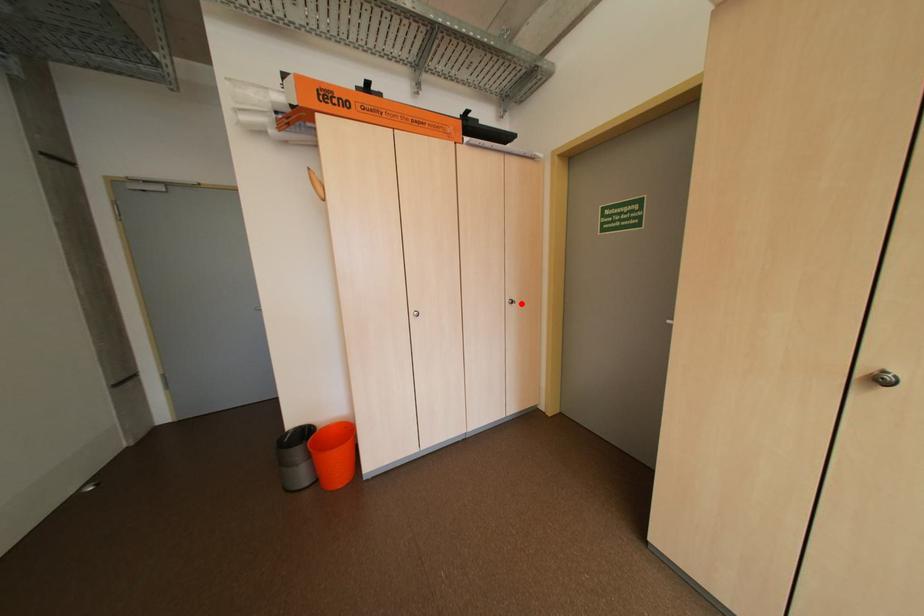
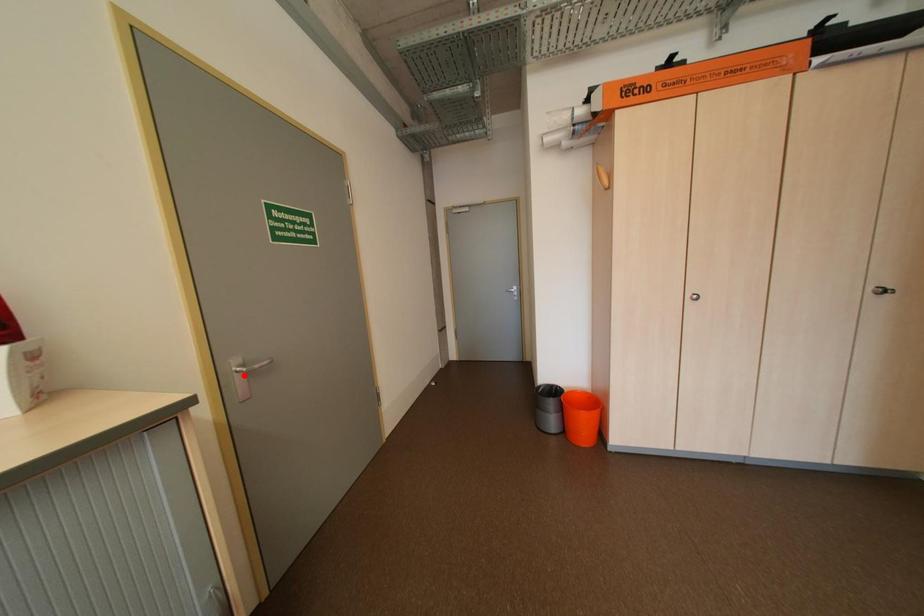
I am providing you with two images of the same scene from different viewpoints. A red point is marked on the first image and another point is marked on the second image. Do the highlighted points in image1 and image2 indicate the same real-world spot?

No